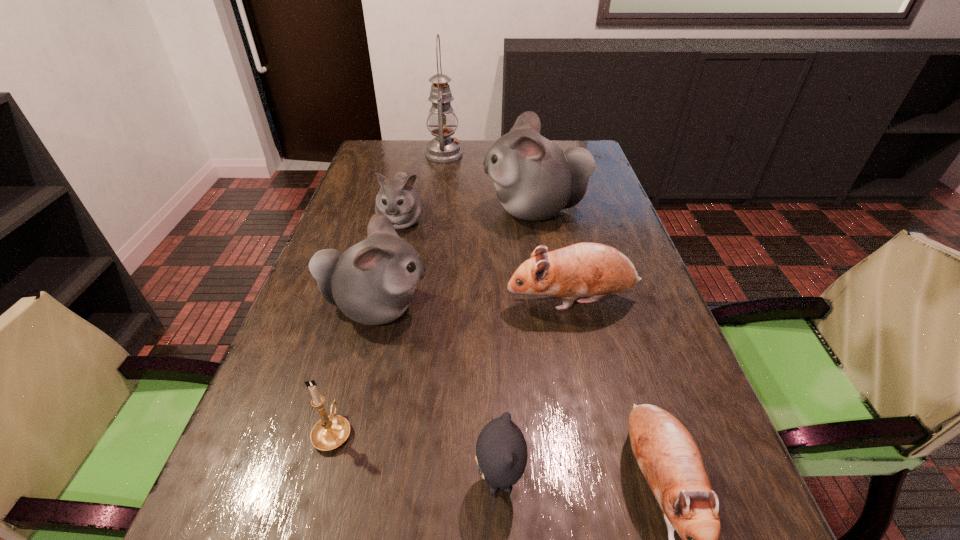
Identify the location of the farthest object. (442, 120).

Where is `oil lamp`? oil lamp is located at coordinates (442, 120).

You are a GUI agent. You are given a task and a screenshot of the screen. Output one action in this format:
    pyautogui.click(x=<x>, y=<y>)
    Task: Click on the second tallest object
    The height and width of the screenshot is (540, 960).
    Given the screenshot: What is the action you would take?
    pyautogui.click(x=535, y=179)

Locate an element on the screen. This screenshot has width=960, height=540. the rightmost white hamster is located at coordinates (535, 179).

Where is `the nearest white hamster`? The height and width of the screenshot is (540, 960). the nearest white hamster is located at coordinates (373, 282).

What are the coordinates of `the fourth shortest hamster` in the screenshot? It's located at click(x=373, y=282).

Where is `the smallest white hamster`? The image size is (960, 540). the smallest white hamster is located at coordinates (398, 199).

Identify the location of the bigger brown hamster. Image resolution: width=960 pixels, height=540 pixels. (584, 269).

The image size is (960, 540). Identify the location of candle holder. (330, 432).

At what (x,y) coordinates should I click in order to perform the action: click on gray kitten. Please return your answer as a coordinate pair (x, y). Looking at the image, I should click on 501,451.